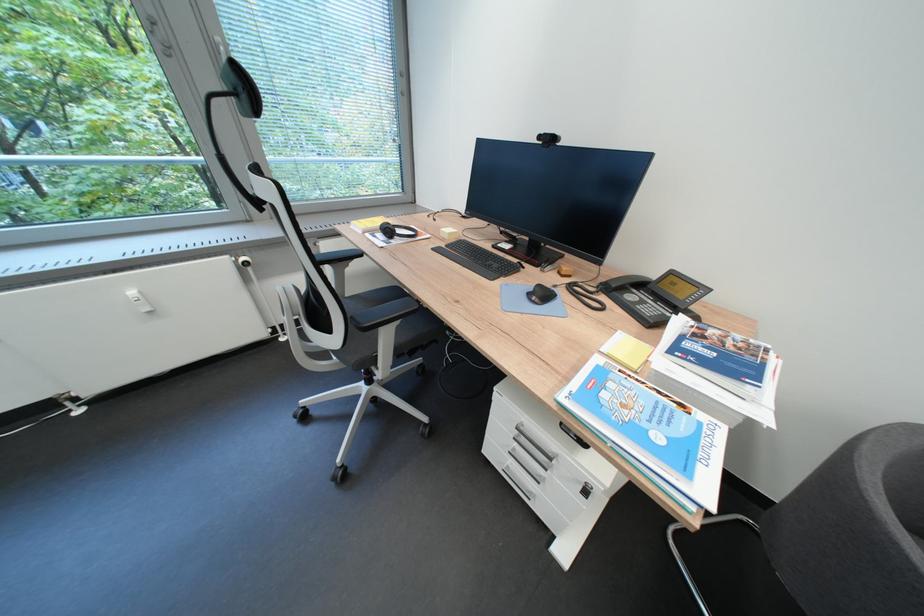
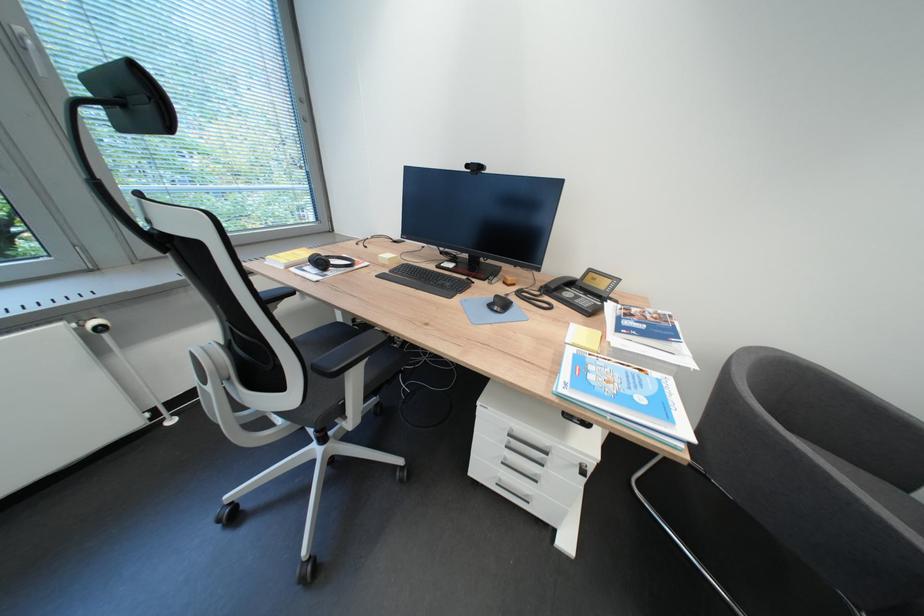
Where in the second image is the point corresponding to (x=400, y=233) from the first image?

(333, 265)